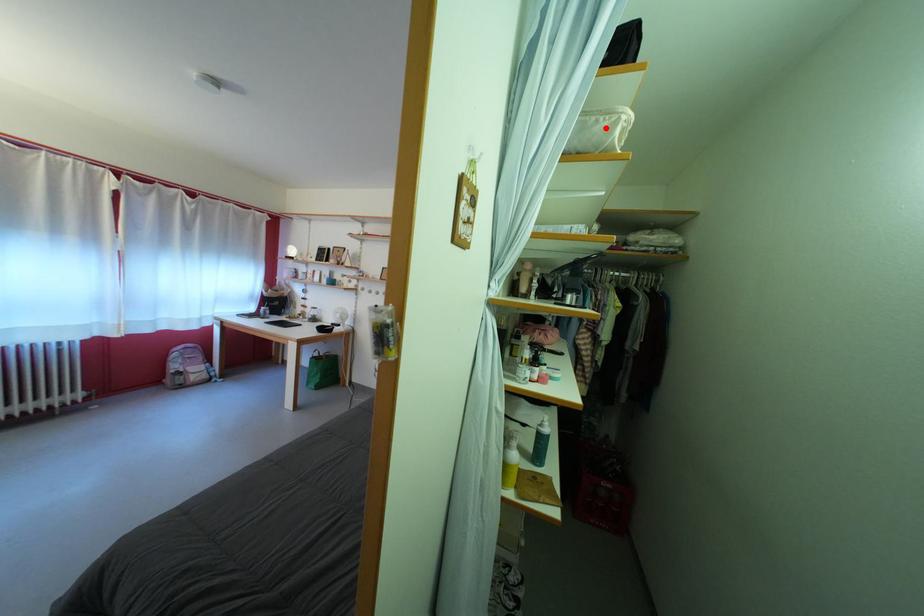
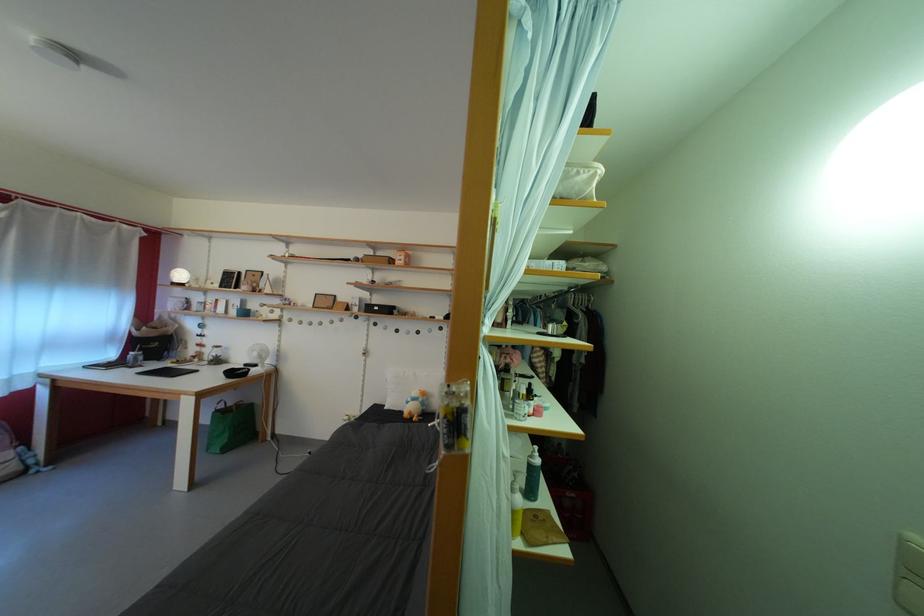
The point at the highlighted location is marked in the first image. Where is the corresponding point in the second image?

(587, 179)